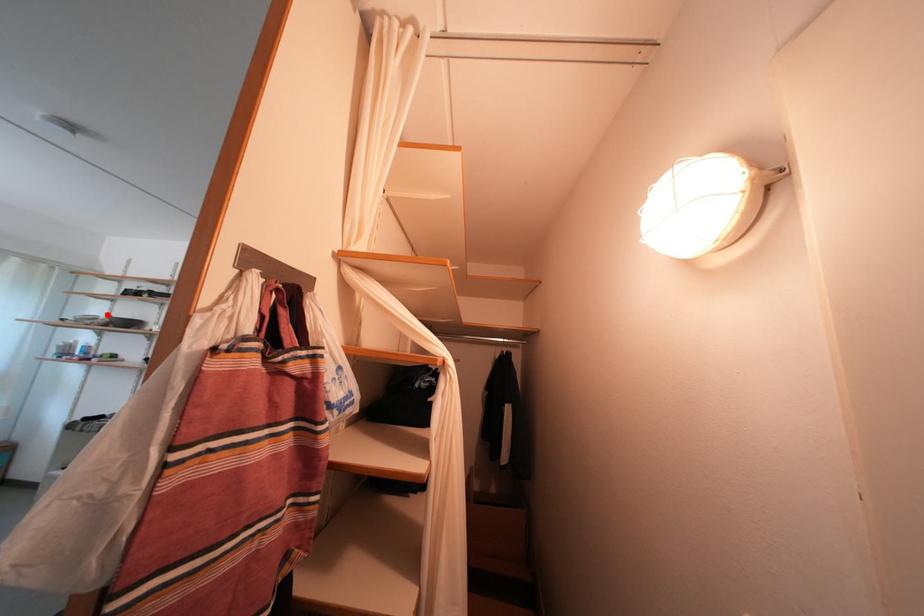
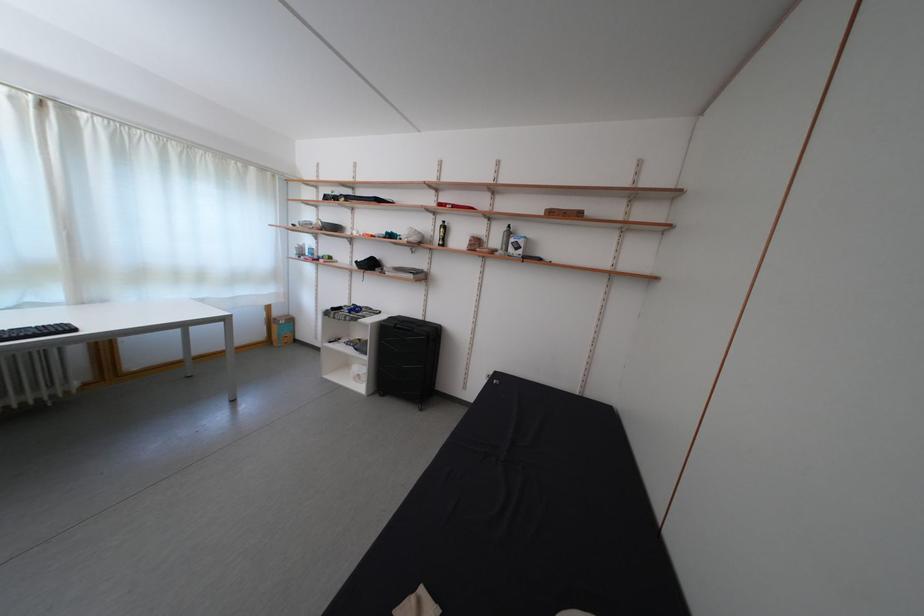
Locate, in the second image, the point that corresponds to the highlighted location in the first image.

(319, 221)